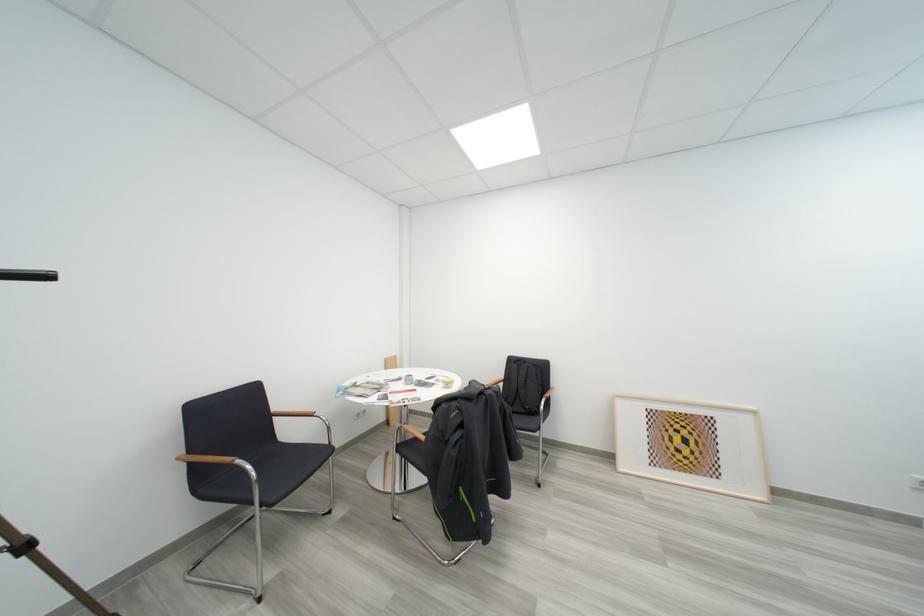
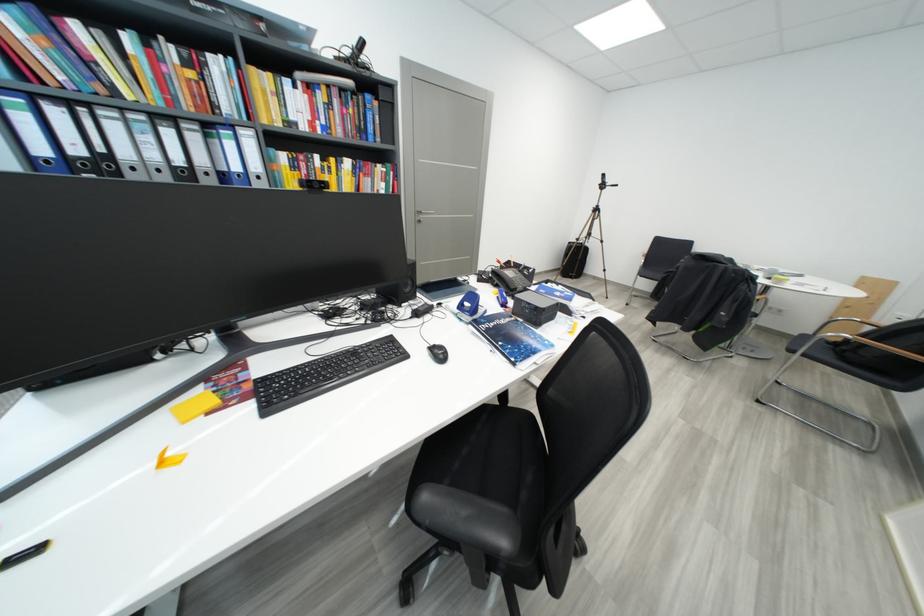
In the second image, find the point that corresponds to pixel 261 477 in the first image.

(652, 265)